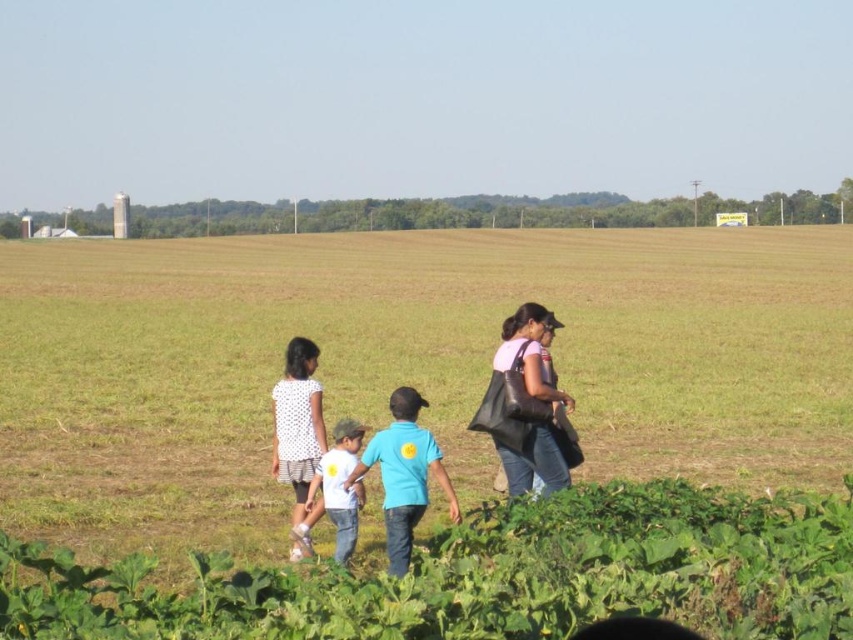
Describe the element at coordinates (531, 353) in the screenshot. I see `matte black bag at center` at that location.

Is point (549, 358) less distant than point (306, 413)?

That is False.

Find the location of `matte black bag at center`. matte black bag at center is located at coordinates (531, 353).

What are the coordinates of `matte black bag at center` in the screenshot? It's located at (531, 353).

Is matte blue shirt at center bigger than white cotton shirt at center?

Indeed, matte blue shirt at center has a larger size compared to white cotton shirt at center.

Which is below, matte blue shirt at center or white cotton shirt at center?

white cotton shirt at center is below.

What do you see at coordinates (525, 404) in the screenshot?
I see `matte blue shirt at center` at bounding box center [525, 404].

Where is `matte blue shirt at center`? The width and height of the screenshot is (853, 640). matte blue shirt at center is located at coordinates tap(525, 404).

Based on the photo, can you confirm if green grass field at center is taller than matte blue shirt at center?

Indeed, green grass field at center has a greater height compared to matte blue shirt at center.

Is the position of green grass field at center more distant than that of matte blue shirt at center?

No, it is not.

You are a GUI agent. You are given a task and a screenshot of the screen. Output one action in this format:
    pyautogui.click(x=<x>, y=<y>)
    Task: Click on the green grass field at center
    This screenshot has height=640, width=853.
    Given the screenshot: What is the action you would take?
    pyautogui.click(x=403, y=365)

Identify the location of green grass field at center. (403, 365).